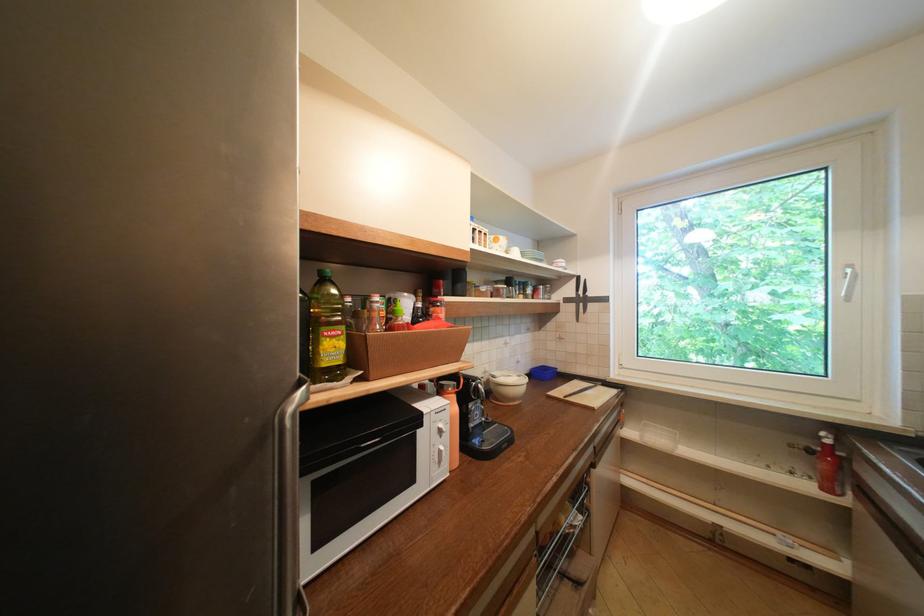
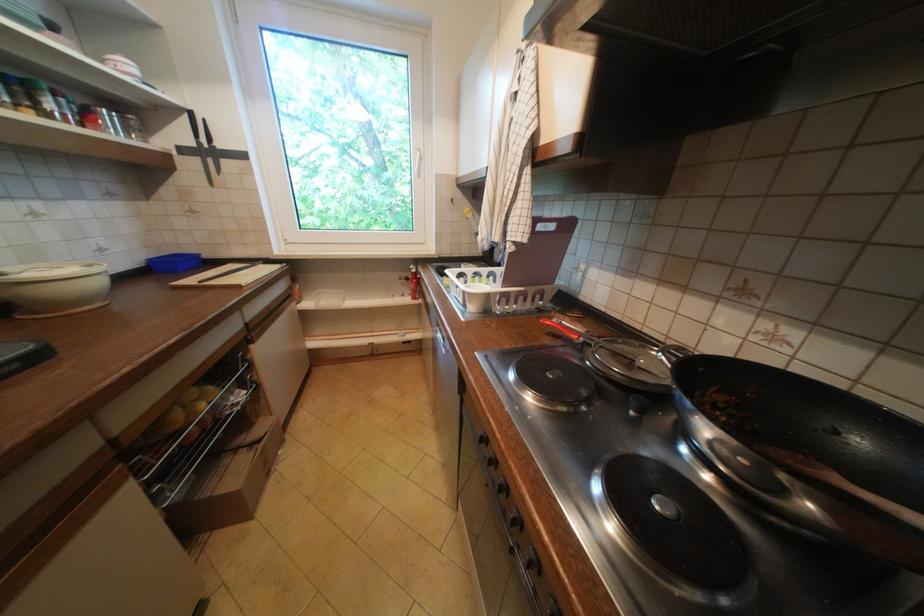
The first image is from the beginning of the video and the second image is from the end. How did the camera likely rotate when shooting the video?

The camera's rotation is toward right-down.